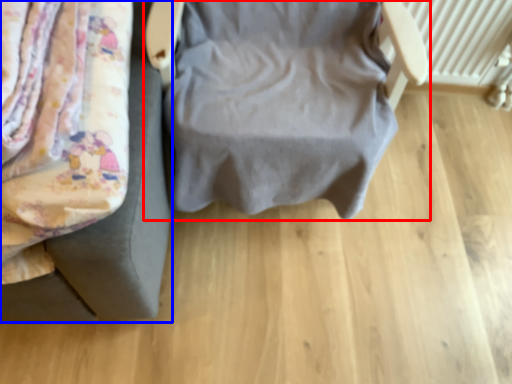
Question: Which object is closer to the camera taking this photo, furniture (highlighted by a red box) or furniture (highlighted by a blue box)?

Choices:
 (A) furniture
 (B) furniture

Answer: (B)